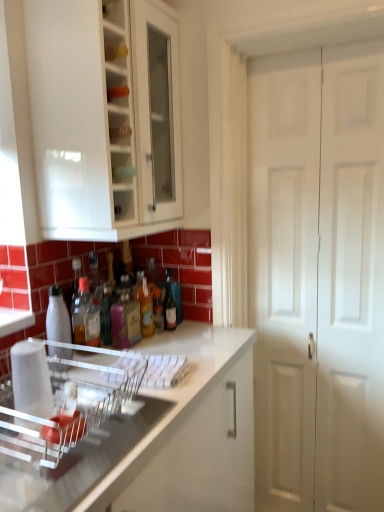
Question: Can we say pink matte bottle at center, the third bottle in the left-to-right sequence, lies outside clear plastic dish rack at center?

Choices:
 (A) yes
 (B) no

Answer: (A)

Question: Does pink matte bottle at center, marked as the 4th bottle in a right-to-left arrangement, appear on the left side of clear plastic dish rack at center?

Choices:
 (A) yes
 (B) no

Answer: (B)

Question: Is pink matte bottle at center, marked as the 4th bottle in a right-to-left arrangement, oriented towards clear plastic dish rack at center?

Choices:
 (A) no
 (B) yes

Answer: (A)

Question: Is the position of pink matte bottle at center, the third bottle in the left-to-right sequence, more distant than that of clear plastic dish rack at center?

Choices:
 (A) yes
 (B) no

Answer: (A)

Question: Considering the relative sizes of pink matte bottle at center, marked as the 4th bottle in a right-to-left arrangement, and clear plastic dish rack at center in the image provided, is pink matte bottle at center, marked as the 4th bottle in a right-to-left arrangement, thinner than clear plastic dish rack at center?

Choices:
 (A) yes
 (B) no

Answer: (A)

Question: Is white glossy cabinet at upper left inside or outside of clear plastic dish rack at lower left?

Choices:
 (A) outside
 (B) inside

Answer: (A)

Question: Visually, is white glossy cabinet at upper left positioned to the left or to the right of clear plastic dish rack at lower left?

Choices:
 (A) right
 (B) left

Answer: (A)

Question: Is white glossy cabinet at upper left bigger or smaller than clear plastic dish rack at lower left?

Choices:
 (A) small
 (B) big

Answer: (B)

Question: Considering their positions, is white glossy cabinet at upper left located in front of or behind clear plastic dish rack at lower left?

Choices:
 (A) front
 (B) behind

Answer: (B)

Question: Is translucent plastic bottle at center, which is counted as the second bottle, starting from the right, spatially inside matte glass bottle at center, the sixth bottle when ordered from left to right, or outside of it?

Choices:
 (A) inside
 (B) outside

Answer: (B)

Question: In terms of size, does translucent plastic bottle at center, positioned as the 5th bottle in left-to-right order, appear bigger or smaller than matte glass bottle at center, which appears as the first bottle when viewed from the right?

Choices:
 (A) small
 (B) big

Answer: (B)

Question: From the image's perspective, is translucent plastic bottle at center, which is counted as the second bottle, starting from the right, positioned above or below matte glass bottle at center, which appears as the first bottle when viewed from the right?

Choices:
 (A) above
 (B) below

Answer: (B)

Question: From their relative heights in the image, would you say translucent plastic bottle at center, positioned as the 5th bottle in left-to-right order, is taller or shorter than matte glass bottle at center, which appears as the first bottle when viewed from the right?

Choices:
 (A) tall
 (B) short

Answer: (B)

Question: Is translucent plastic bottle at center, positioned as the 5th bottle in left-to-right order, to the left or to the right of clear plastic dish rack at center in the image?

Choices:
 (A) right
 (B) left

Answer: (A)

Question: Is point (162, 324) positioned closer to the camera than point (46, 458)?

Choices:
 (A) closer
 (B) farther

Answer: (B)